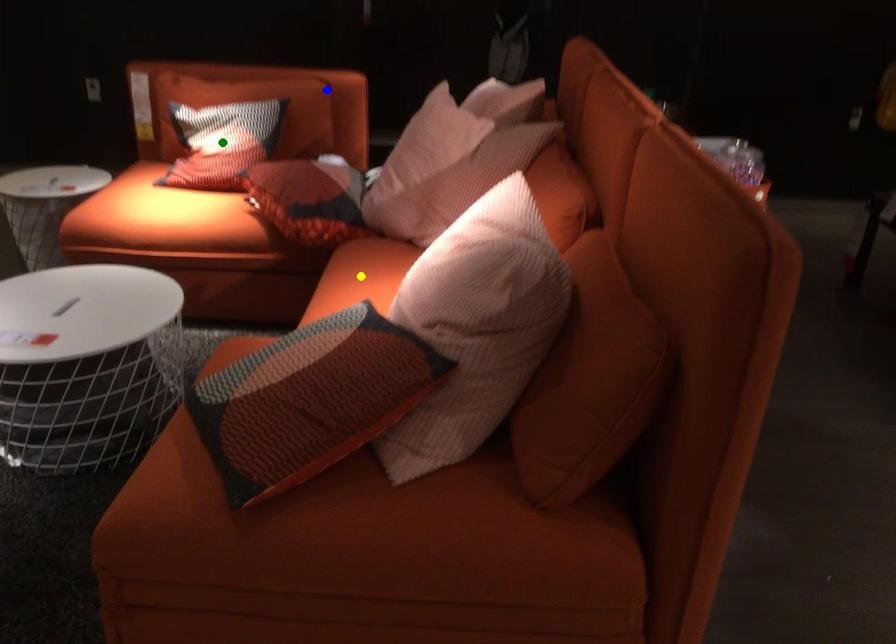
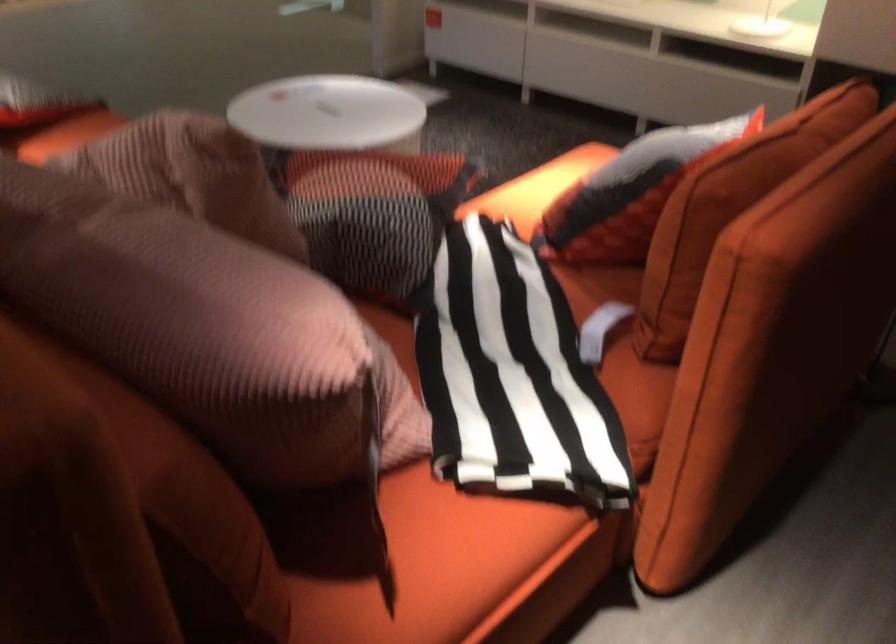
I am providing you with two images of the same scene from different viewpoints. Three points are marked in image1. Which point corresponds to a part or object that is occluded in image2?In image1, three points are marked. Which of them correspond to a part or object that is occluded in image2?Among the three points shown in image1, which one corresponds to a part or object that is no longer visible due to occlusion in image2?

yellow point, green point